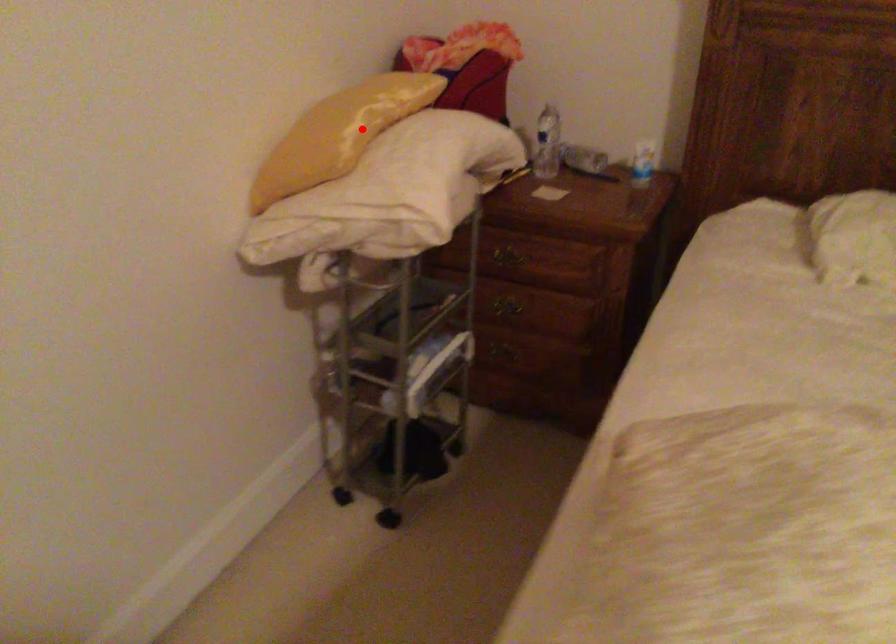
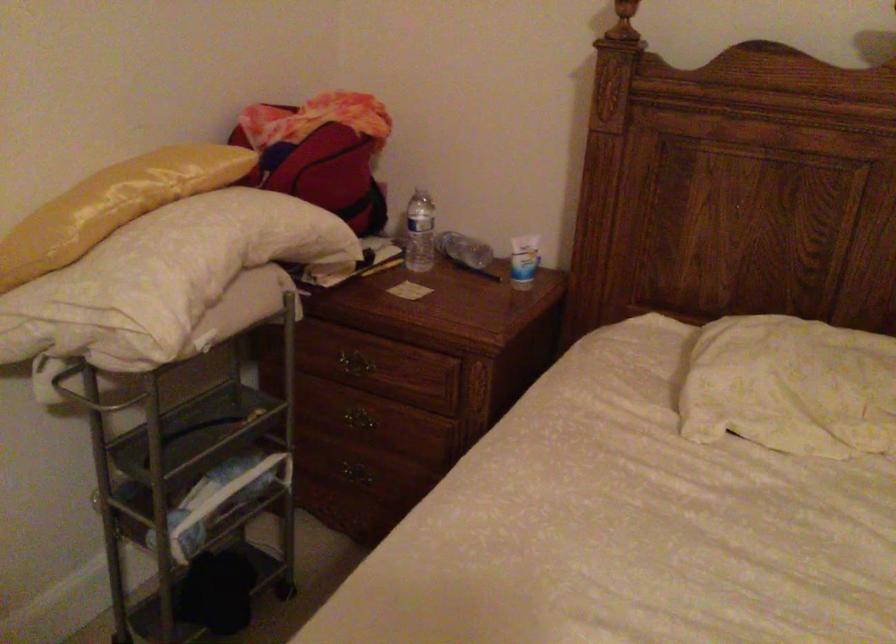
In the second image, find the point that corresponds to the highlighted location in the first image.

(113, 205)